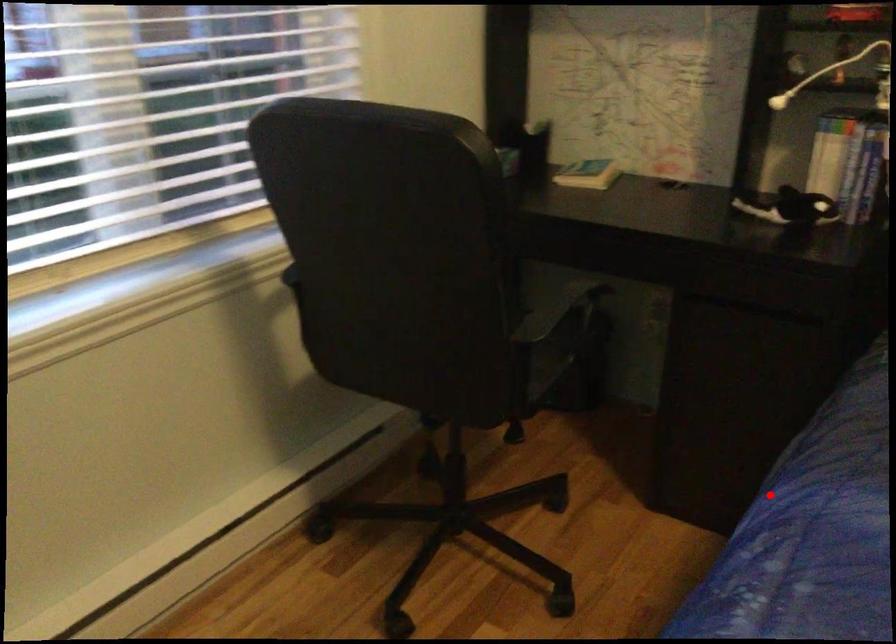
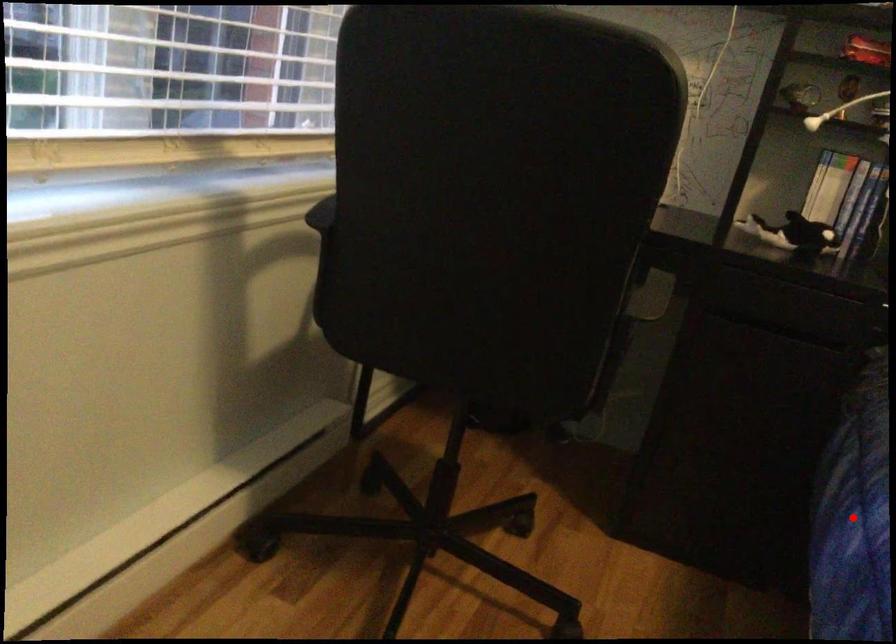
I am providing you with two images of the same scene from different viewpoints. A red point is marked on the first image and another point is marked on the second image. Does the point marked in image1 correspond to the same location as the one in image2?

Yes